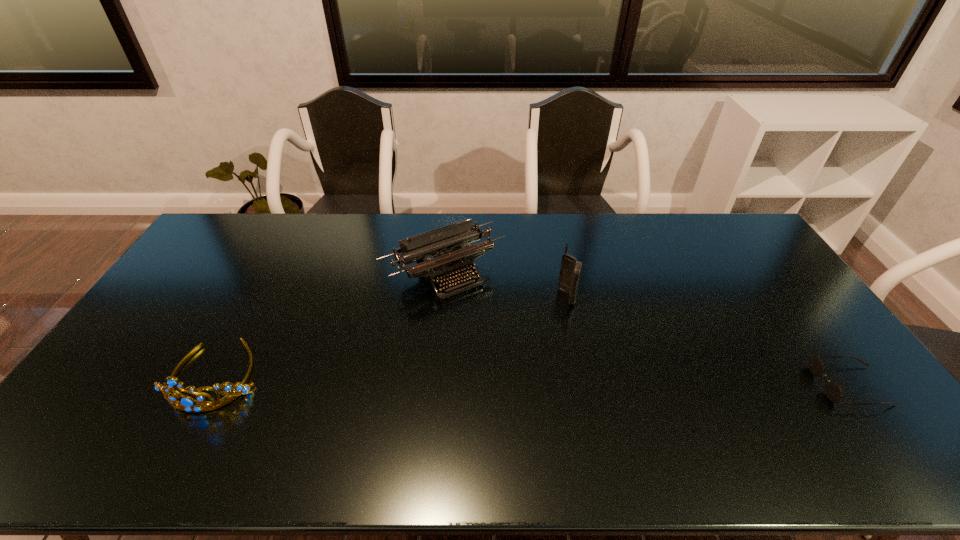
Find the location of a particular element. Image resolution: width=960 pixels, height=540 pixels. vacant space that satisfies the following two spatial constraints: 1. on the front side of the rightmost object; 2. on the front-facing side of the third object from left to right is located at coordinates (587, 385).